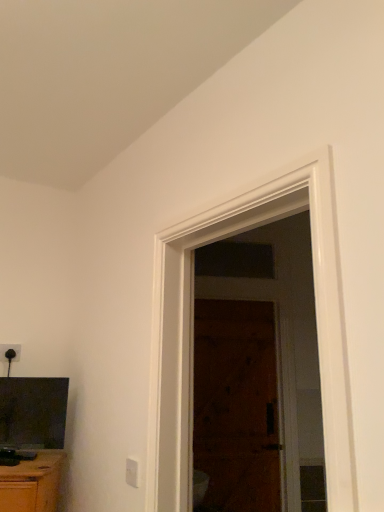
Question: Would you say black plastic electric outlet at upper left, the 2th electric outlet from the right, is outside white plastic electric outlet at lower center, acting as the first electric outlet starting from the right?

Choices:
 (A) no
 (B) yes

Answer: (B)

Question: Considering the relative sizes of black plastic electric outlet at upper left, the first electric outlet viewed from the left, and white plastic electric outlet at lower center, which is the 2th electric outlet in back-to-front order, in the image provided, is black plastic electric outlet at upper left, the first electric outlet viewed from the left, smaller than white plastic electric outlet at lower center, which is the 2th electric outlet in back-to-front order,?

Choices:
 (A) yes
 (B) no

Answer: (A)

Question: Is black plastic electric outlet at upper left, the 1th electric outlet when ordered from top to bottom, to the left of white plastic electric outlet at lower center, which is counted as the second electric outlet, starting from the top, from the viewer's perspective?

Choices:
 (A) yes
 (B) no

Answer: (A)

Question: Is black plastic electric outlet at upper left, which ranks as the first electric outlet in back-to-front order, not near white plastic electric outlet at lower center, marked as the 1th electric outlet in a front-to-back arrangement?

Choices:
 (A) yes
 (B) no

Answer: (B)

Question: From a real-world perspective, is black plastic electric outlet at upper left, which appears as the second electric outlet when ordered from the bottom, on white plastic electric outlet at lower center, which is the 2th electric outlet in back-to-front order?

Choices:
 (A) yes
 (B) no

Answer: (A)

Question: Is black plastic electric outlet at upper left, which ranks as the first electric outlet in back-to-front order, surrounding white plastic electric outlet at lower center, which is counted as the second electric outlet, starting from the top?

Choices:
 (A) yes
 (B) no

Answer: (B)

Question: Is the position of brown wooden screen door at center more distant than that of matte black tv at lower left?

Choices:
 (A) no
 (B) yes

Answer: (B)

Question: From a real-world perspective, is brown wooden screen door at center under matte black tv at lower left?

Choices:
 (A) no
 (B) yes

Answer: (A)

Question: Considering the relative sizes of brown wooden screen door at center and matte black tv at lower left in the image provided, is brown wooden screen door at center smaller than matte black tv at lower left?

Choices:
 (A) no
 (B) yes

Answer: (A)

Question: Would you consider brown wooden screen door at center to be distant from matte black tv at lower left?

Choices:
 (A) no
 (B) yes

Answer: (B)

Question: Is the depth of brown wooden screen door at center less than that of matte black tv at lower left?

Choices:
 (A) no
 (B) yes

Answer: (A)

Question: Considering the relative positions of brown wooden screen door at center and matte black tv at lower left in the image provided, is brown wooden screen door at center to the right of matte black tv at lower left from the viewer's perspective?

Choices:
 (A) yes
 (B) no

Answer: (A)

Question: Can you confirm if wooden door at center is bigger than white plastic electric outlet at lower center, which is counted as the second electric outlet, starting from the top?

Choices:
 (A) yes
 (B) no

Answer: (A)